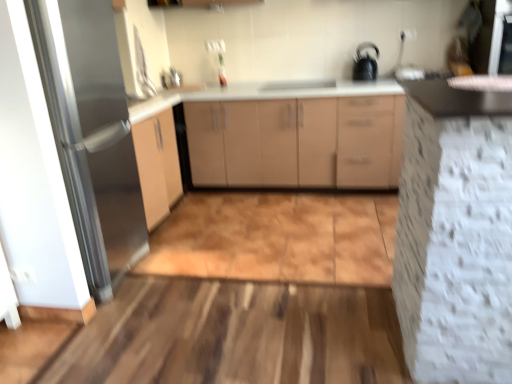
You are a GUI agent. You are given a task and a screenshot of the screen. Output one action in this format:
    pyautogui.click(x=<x>, y=<y>)
    Task: Click on the vacant space underneath black glossy kettle at upper right (from a real-world perspective)
    
    Given the screenshot: What is the action you would take?
    pyautogui.click(x=367, y=78)